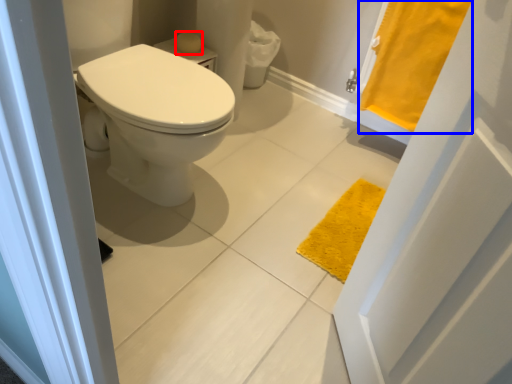
Question: Which object appears farthest to the camera in this image, soap (highlighted by a red box) or bath towel (highlighted by a blue box)?

Choices:
 (A) soap
 (B) bath towel

Answer: (A)